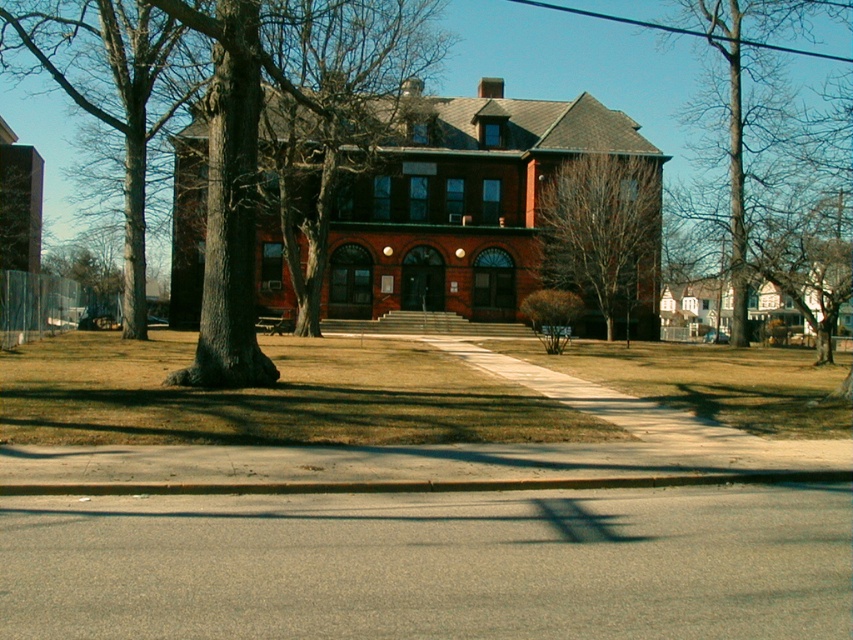
Question: Which point is farther from the camera taking this photo?

Choices:
 (A) (140, 74)
 (B) (747, 116)
 (C) (252, 186)

Answer: (B)

Question: Does dark brown bark tree at center have a smaller size compared to bare wood tree at upper right?

Choices:
 (A) no
 (B) yes

Answer: (B)

Question: Is brown bark tree at left to the left of bare wood tree at upper right from the viewer's perspective?

Choices:
 (A) no
 (B) yes

Answer: (B)

Question: Which point is closer to the camera taking this photo?

Choices:
 (A) (181, 369)
 (B) (730, 198)

Answer: (A)

Question: Can you confirm if dark brown bark tree at center is wider than brown bark tree at left?

Choices:
 (A) yes
 (B) no

Answer: (B)

Question: Which of the following is the farthest from the observer?

Choices:
 (A) brown bark tree at left
 (B) bare branches at right

Answer: (B)